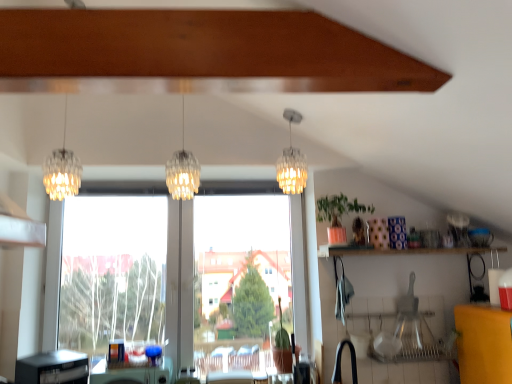
Question: Is translucent glass pendant light at center, acting as the 2th lamp starting from the left, behind green matte plant at upper right?

Choices:
 (A) yes
 (B) no

Answer: (B)

Question: From a real-world perspective, is translucent glass pendant light at center, acting as the 2th lamp starting from the left, beneath green matte plant at upper right?

Choices:
 (A) no
 (B) yes

Answer: (A)

Question: Can you confirm if translucent glass pendant light at center, acting as the 2th lamp starting from the left, is bigger than green matte plant at upper right?

Choices:
 (A) no
 (B) yes

Answer: (B)

Question: From the image's perspective, is translucent glass pendant light at center, which is the 2th lamp in right-to-left order, beneath green matte plant at upper right?

Choices:
 (A) yes
 (B) no

Answer: (B)

Question: Is translucent glass pendant light at center, which is the 2th lamp in right-to-left order, not near green matte plant at upper right?

Choices:
 (A) no
 (B) yes

Answer: (A)

Question: Does translucent glass pendant light at center, acting as the 2th lamp starting from the left, have a smaller size compared to green matte plant at upper right?

Choices:
 (A) yes
 (B) no

Answer: (B)

Question: From a real-world perspective, is green matte plant at upper right physically above translucent glass pendant light at center, which is the 2th lamp in right-to-left order?

Choices:
 (A) yes
 (B) no

Answer: (B)

Question: From the image's perspective, is green matte plant at upper right on top of translucent glass pendant light at center, which is the 2th lamp in right-to-left order?

Choices:
 (A) yes
 (B) no

Answer: (B)

Question: Can you confirm if green matte plant at upper right is positioned to the right of translucent glass pendant light at center, which is the 2th lamp in right-to-left order?

Choices:
 (A) yes
 (B) no

Answer: (A)

Question: Are green matte plant at upper right and translucent glass pendant light at center, acting as the 2th lamp starting from the left, making contact?

Choices:
 (A) yes
 (B) no

Answer: (B)

Question: Can you confirm if green matte plant at upper right is taller than translucent glass pendant light at center, acting as the 2th lamp starting from the left?

Choices:
 (A) no
 (B) yes

Answer: (A)

Question: Would you say green matte plant at upper right contains translucent glass pendant light at center, acting as the 2th lamp starting from the left?

Choices:
 (A) yes
 (B) no

Answer: (B)

Question: From the image's perspective, is translucent glass chandelier at left, the 3th lamp from the right, on top of clear glass chandelier at center, positioned as the 3th lamp in left-to-right order?

Choices:
 (A) no
 (B) yes

Answer: (B)